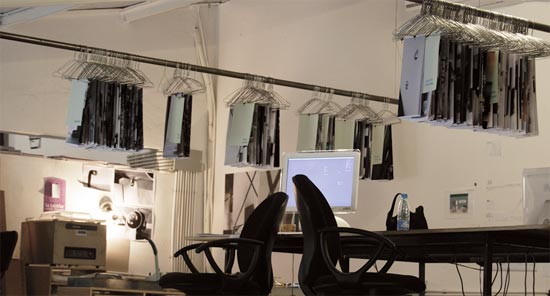
The width and height of the screenshot is (550, 296). What are the coordinates of `screen` in the screenshot? It's located at (340, 188).